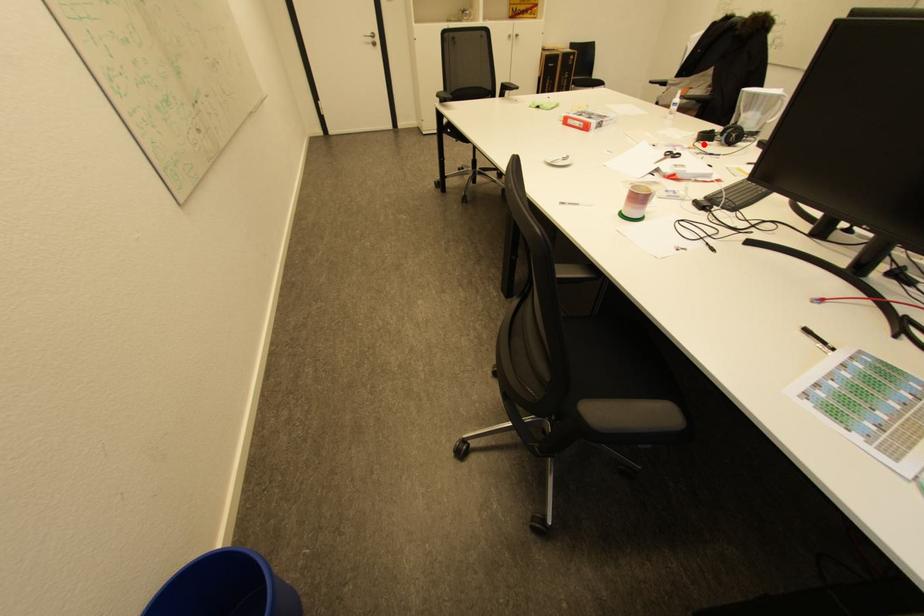
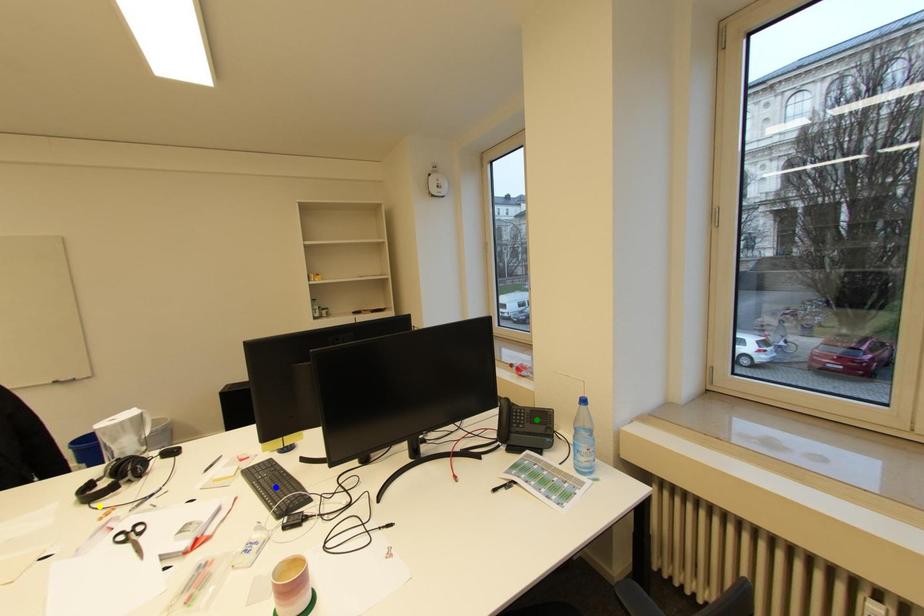
Question: I am providing you with two images of the same scene from different viewpoints. A red point is marked on the first image. You are given multiple points on the second image. Which point in image 2 is actually the same real-world point as the red point in image 1?

Choices:
 (A) green point
 (B) yellow point
 (C) blue point

Answer: (B)